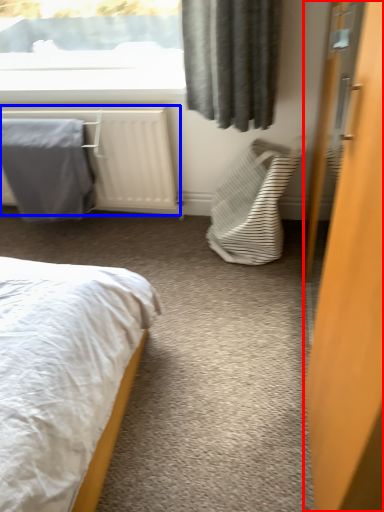
Question: Which of the following is the farthest to the observer, door (highlighted by a red box) or radiator (highlighted by a blue box)?

Choices:
 (A) door
 (B) radiator

Answer: (B)